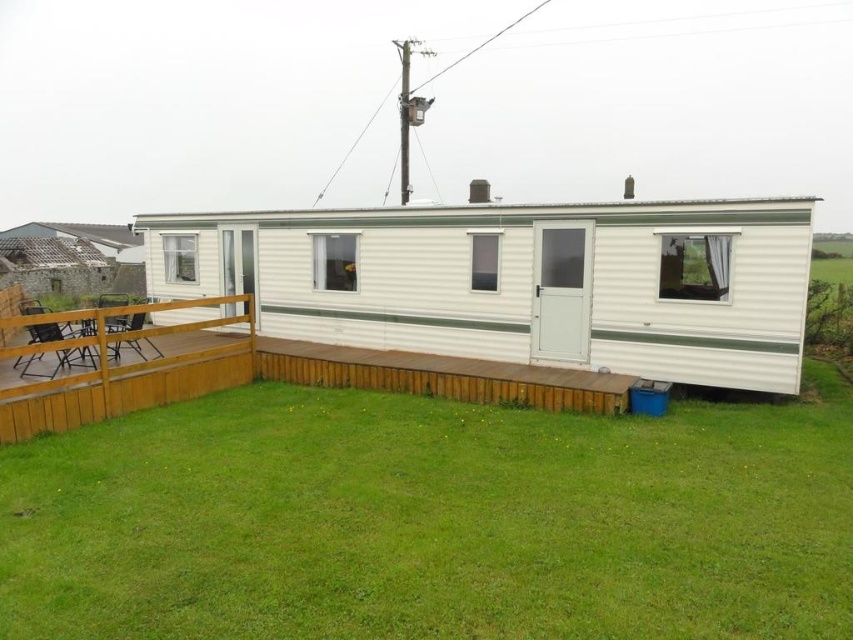
Is green grass at lower center further to the viewer compared to white corrugated metal trailer at center?

No, it is not.

Is green grass at lower center shorter than white corrugated metal trailer at center?

Indeed, green grass at lower center has a lesser height compared to white corrugated metal trailer at center.

Image resolution: width=853 pixels, height=640 pixels. What do you see at coordinates (432, 520) in the screenshot?
I see `green grass at lower center` at bounding box center [432, 520].

Image resolution: width=853 pixels, height=640 pixels. I want to click on green grass at lower center, so click(432, 520).

Which of these two, green grass at lower center or brown wooden deck at lower left, stands taller?

brown wooden deck at lower left

Can you confirm if green grass at lower center is wider than brown wooden deck at lower left?

Yes, green grass at lower center is wider than brown wooden deck at lower left.

Which is behind, point (831, 378) or point (103, 349)?

Positioned behind is point (831, 378).

The height and width of the screenshot is (640, 853). Find the location of `green grass at lower center`. green grass at lower center is located at coordinates (432, 520).

Based on the photo, does white corrugated metal trailer at center have a greater width compared to brown wooden deck at lower left?

Indeed, white corrugated metal trailer at center has a greater width compared to brown wooden deck at lower left.

Measure the distance from white corrugated metal trailer at center to brown wooden deck at lower left.

They are 6.35 meters apart.

Is point (535, 259) less distant than point (154, 336)?

No, it is behind (154, 336).

Locate an element on the screen. The image size is (853, 640). white corrugated metal trailer at center is located at coordinates (518, 282).